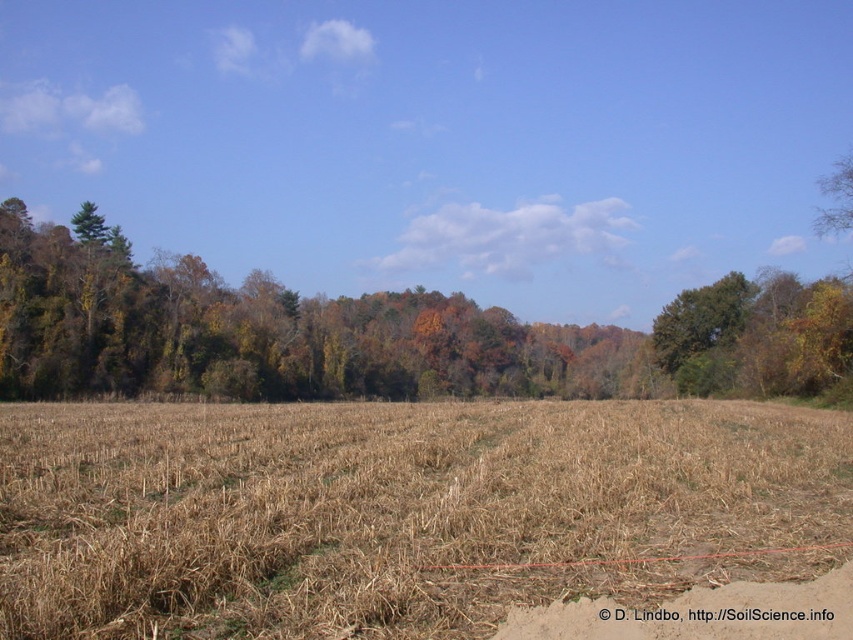
Question: Which of the following is the farthest from the observer?

Choices:
 (A) (21, 468)
 (B) (706, 289)

Answer: (B)

Question: Is brown dry grass at center above brown dirt track at lower center?

Choices:
 (A) yes
 (B) no

Answer: (B)

Question: Which point appears closest to the camera in this image?

Choices:
 (A) (177, 419)
 (B) (784, 604)

Answer: (B)

Question: Does brown dry grass at center have a larger size compared to green leafy tree at center?

Choices:
 (A) no
 (B) yes

Answer: (B)

Question: Can you confirm if brown dirt track at lower center is positioned to the right of green leafy tree at center?

Choices:
 (A) yes
 (B) no

Answer: (B)

Question: Which object is farther from the camera taking this photo?

Choices:
 (A) green leafy tree at center
 (B) brown dry grass at center
 (C) brown dirt track at lower center

Answer: (A)